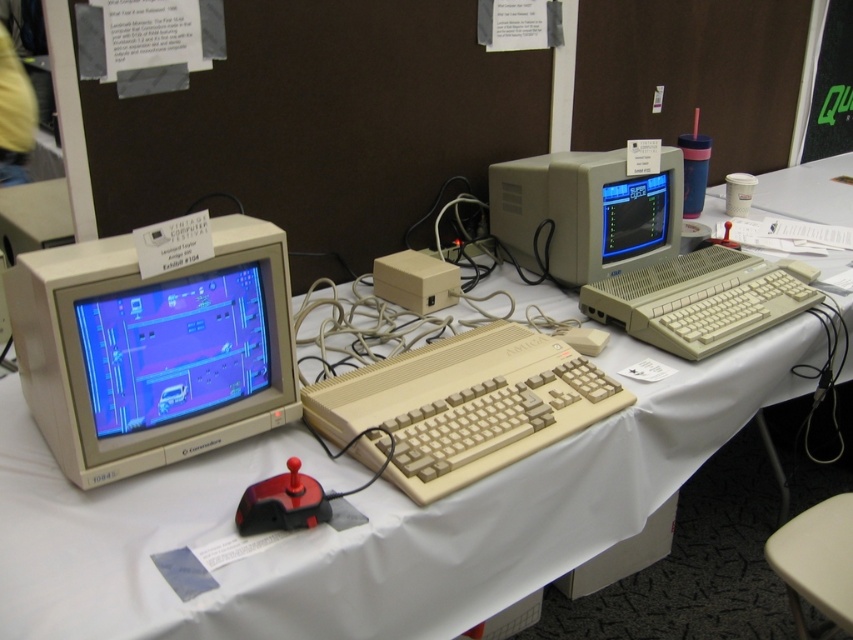
Question: Which object appears closest to the camera in this image?

Choices:
 (A) beige plastic keyboard at center
 (B) matte beige monitor at left
 (C) shiny blue crt monitor at left

Answer: (B)

Question: Considering the relative positions of shiny blue crt monitor at left and beige plastic monitor at center in the image provided, where is shiny blue crt monitor at left located with respect to beige plastic monitor at center?

Choices:
 (A) left
 (B) right

Answer: (A)

Question: Can you confirm if beige plastic keyboard at center is positioned to the right of shiny blue crt monitor at left?

Choices:
 (A) no
 (B) yes

Answer: (B)

Question: Is matte beige monitor at left closer to camera compared to rubberized black mouse at center?

Choices:
 (A) no
 (B) yes

Answer: (B)

Question: Which point appears closest to the camera in this image?

Choices:
 (A) (263, 268)
 (B) (83, 426)
 (C) (497, 179)

Answer: (B)

Question: Which object is farther from the camera taking this photo?

Choices:
 (A) shiny blue crt monitor at left
 (B) beige plastic monitor at center

Answer: (B)